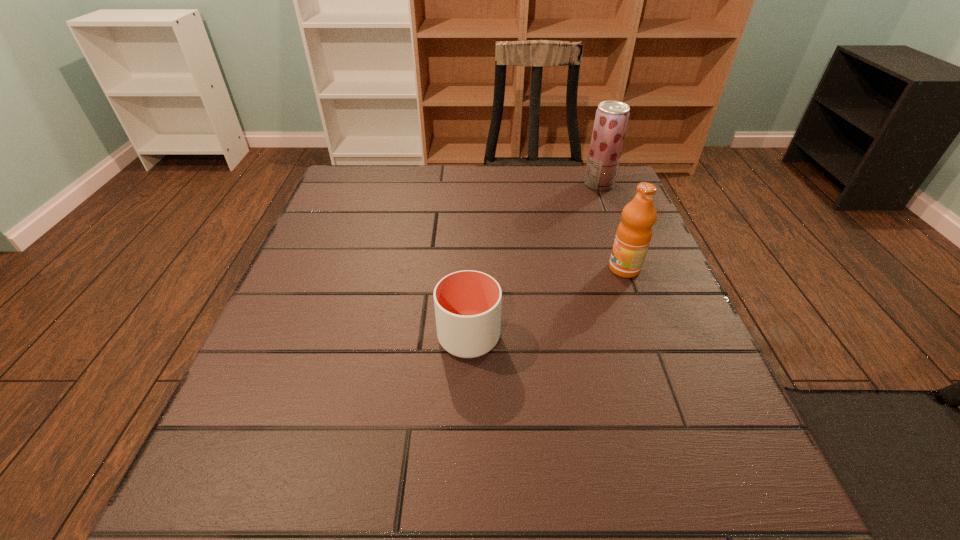
This screenshot has width=960, height=540. I want to click on the farthest object, so (611, 118).

I want to click on the second nearest object, so click(634, 233).

Image resolution: width=960 pixels, height=540 pixels. I want to click on the shortest object, so click(x=467, y=303).

Image resolution: width=960 pixels, height=540 pixels. Identify the location of cup. (x=467, y=303).

This screenshot has height=540, width=960. In order to click on free region located 0.150m on the left of the farthest object in this screenshot , I will do (529, 184).

You are a GUI agent. You are given a task and a screenshot of the screen. Output one action in this format:
    pyautogui.click(x=<x>, y=<y>)
    Task: Click on the vacant area situated 0.090m on the label side of the second farthest object
    
    Given the screenshot: What is the action you would take?
    pyautogui.click(x=566, y=269)

The height and width of the screenshot is (540, 960). I want to click on free location located 0.280m on the label side of the second farthest object, so click(x=477, y=269).

Image resolution: width=960 pixels, height=540 pixels. I want to click on vacant area located 0.290m on the label side of the second farthest object, so click(x=473, y=269).

Find the location of a particular element. The width and height of the screenshot is (960, 540). vacant point located 0.150m on the left of the shortest object is located at coordinates (355, 337).

The image size is (960, 540). I want to click on object present at the far edge, so 611,118.